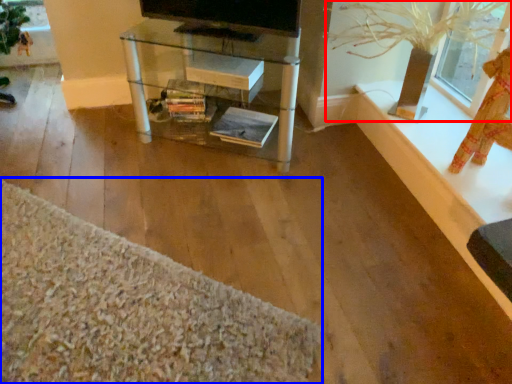
Question: Which point is closer to the camera, plant (highlighted by a red box) or plain (highlighted by a blue box)?

Choices:
 (A) plant
 (B) plain

Answer: (B)